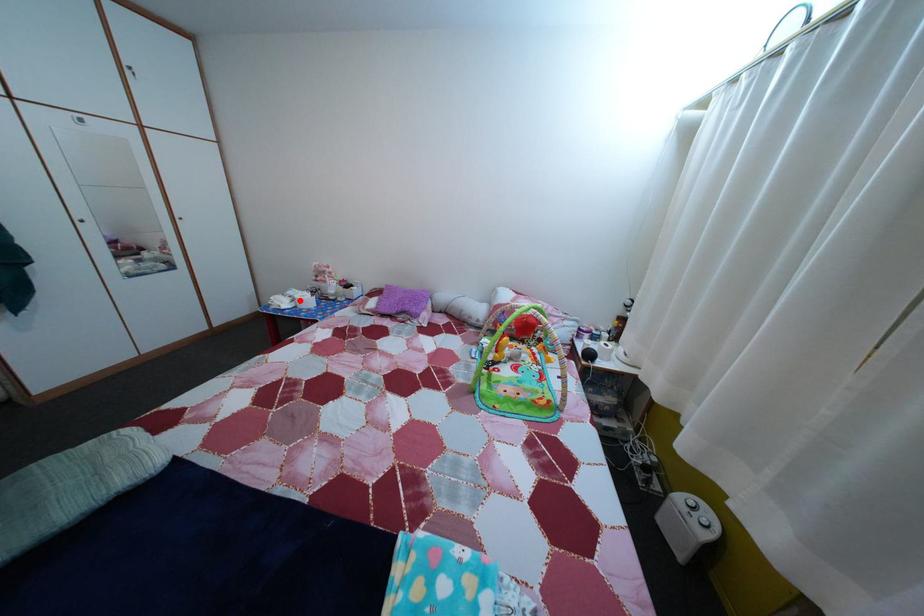
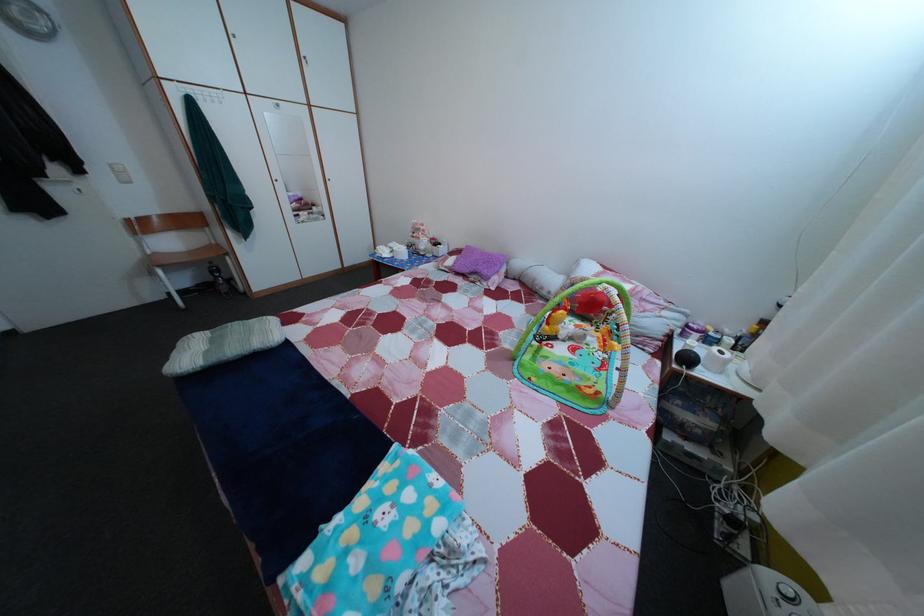
In the second image, find the point that corresponds to the highlighted location in the first image.

(400, 253)